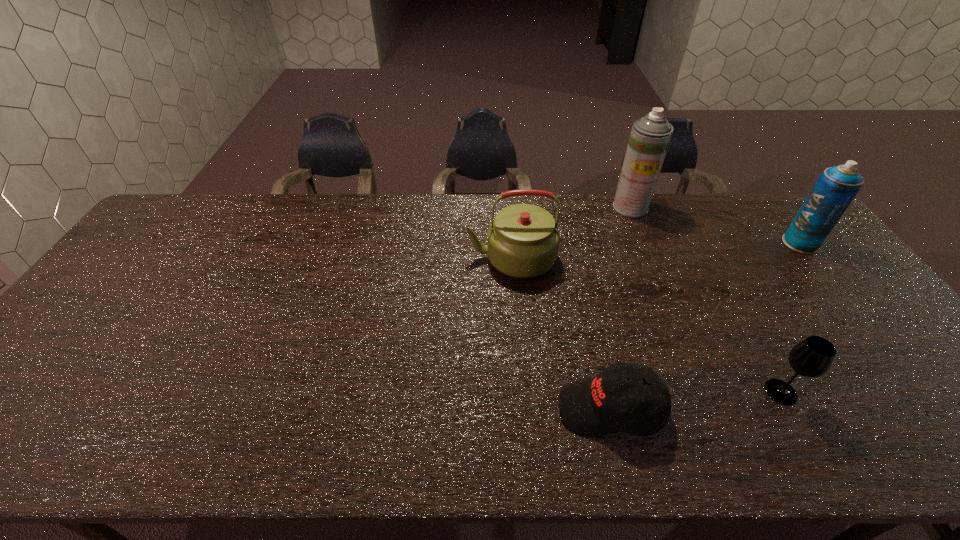
Image resolution: width=960 pixels, height=540 pixels. What are the coordinates of `blank region between the left aerosol can and the shortest object` in the screenshot? It's located at (620, 308).

You are a GUI agent. You are given a task and a screenshot of the screen. Output one action in this format:
    pyautogui.click(x=<x>, y=<y>)
    Task: Click on the empty space between the second object from right to left and the rightmost object
    This screenshot has width=960, height=540.
    Given the screenshot: What is the action you would take?
    pyautogui.click(x=791, y=318)

Where is `vacant space that is in between the second shortest object and the baseball cap`? This screenshot has height=540, width=960. vacant space that is in between the second shortest object and the baseball cap is located at coordinates (696, 400).

At what (x,y) coordinates should I click in order to perform the action: click on free space that is in between the wineglass and the kettle. Please return your answer as a coordinate pair (x, y). The image size is (960, 540). Looking at the image, I should click on (646, 325).

The image size is (960, 540). I want to click on unoccupied position between the kettle and the wineglass, so click(646, 325).

Where is `vacant region between the fourth object from left to right and the baseball cap`? The width and height of the screenshot is (960, 540). vacant region between the fourth object from left to right and the baseball cap is located at coordinates (696, 400).

This screenshot has height=540, width=960. Identify the location of vacant space that is in between the shorter aerosol can and the fourth tallest object. [x=791, y=318].

Where is `object that is the closest to the shortest object`? object that is the closest to the shortest object is located at coordinates (812, 357).

You are a GUI agent. You are given a task and a screenshot of the screen. Output one action in this format:
    pyautogui.click(x=<x>, y=<y>)
    Task: Click on the object that is the fourth closest to the taller aerosol can
    This screenshot has width=960, height=540.
    Given the screenshot: What is the action you would take?
    pyautogui.click(x=812, y=357)

The height and width of the screenshot is (540, 960). I want to click on free location that satisfies the following two spatial constraints: 1. at the spout of the fourth object from left to right; 2. on the right side of the third shortest object, so click(x=521, y=392).